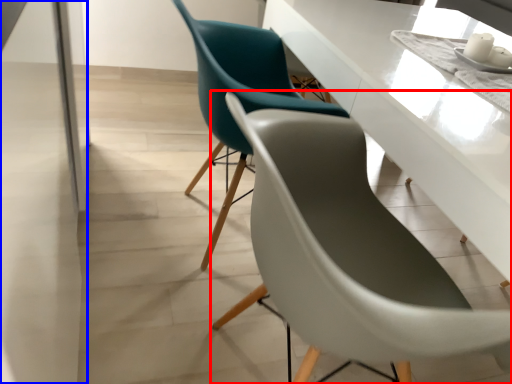
Question: Which object appears closest to the camera in this image, chair (highlighted by a red box) or glass door (highlighted by a blue box)?

Choices:
 (A) chair
 (B) glass door

Answer: (B)